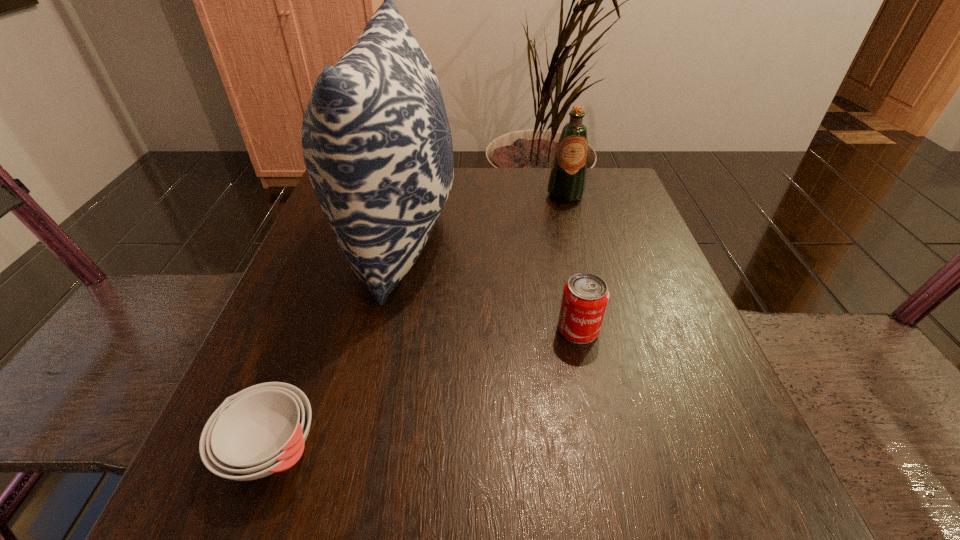
The image size is (960, 540). Identify the location of vacant area that lies between the third shortest object and the tallest object. (482, 215).

Find the location of a particular element. This screenshot has height=540, width=960. vacant area that lies between the soup bowl and the tallest object is located at coordinates (335, 342).

The height and width of the screenshot is (540, 960). What are the coordinates of `unoccupied position between the can and the soup bowl` in the screenshot? It's located at (424, 389).

What are the coordinates of `free spot between the soup bowl and the olive oil` in the screenshot? It's located at (419, 322).

I want to click on object that is the closest one to the cushion, so click(260, 430).

At what (x,y) coordinates should I click in order to perform the action: click on object that is the second nearest to the can. Please return your answer as a coordinate pair (x, y). Looking at the image, I should click on (567, 181).

The width and height of the screenshot is (960, 540). I want to click on vacant space that satisfies the following two spatial constraints: 1. on the front surface of the can; 2. on the right side of the tallest object, so click(378, 329).

This screenshot has width=960, height=540. I want to click on free space in the image that satisfies the following two spatial constraints: 1. on the front-facing side of the second tallest object; 2. on the front surface of the cushion, so click(x=576, y=235).

Image resolution: width=960 pixels, height=540 pixels. Identify the location of free region that satisfies the following two spatial constraints: 1. on the front-facing side of the second tallest object; 2. on the front surface of the tallest object. (576, 235).

Where is `vacant point that satisfies the following two spatial constraints: 1. on the front surface of the third tallest object; 2. on the left side of the cushion`? vacant point that satisfies the following two spatial constraints: 1. on the front surface of the third tallest object; 2. on the left side of the cushion is located at coordinates (378, 329).